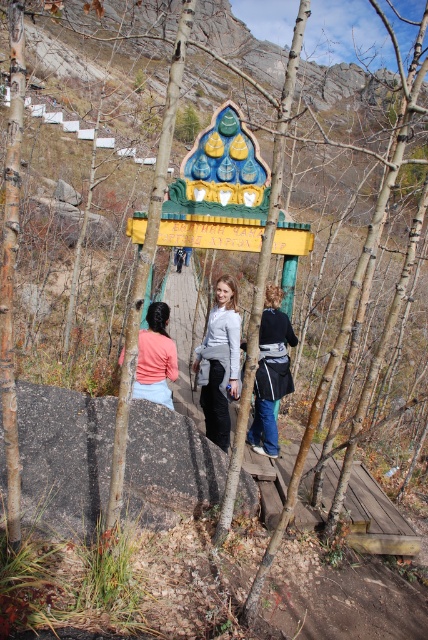
Question: Which of the following is the farthest from the observer?

Choices:
 (A) gray rough rock at lower left
 (B) matte pink fabric at center
 (C) dark gray fabric jacket at center

Answer: (B)

Question: Is yellow painted wood sign at center to the right of matte pink fabric at center from the viewer's perspective?

Choices:
 (A) no
 (B) yes

Answer: (B)

Question: Based on their relative distances, which object is farther from the matte pink fabric at center?

Choices:
 (A) matte gray sweater at center
 (B) gray rough rock at lower left
 (C) matte pink sweater at center
 (D) yellow painted wood sign at center

Answer: (D)

Question: In this image, where is matte gray sweater at center located relative to matte pink sweater at center?

Choices:
 (A) left
 (B) right

Answer: (B)

Question: Estimate the real-world distances between objects in this image. Which object is closer to the dark gray fabric jacket at center?

Choices:
 (A) matte pink fabric at center
 (B) matte gray sweater at center

Answer: (B)

Question: Can you confirm if dark gray fabric jacket at center is positioned below matte pink fabric at center?

Choices:
 (A) yes
 (B) no

Answer: (A)